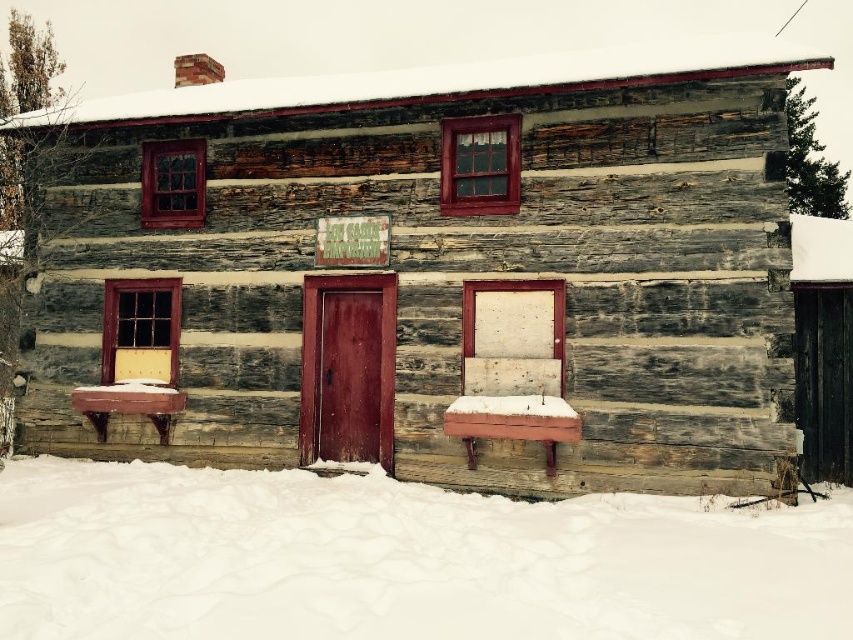
Who is higher up, wooden cabin at center or wooden bench at center?

wooden cabin at center

Which is in front, point (604, 160) or point (503, 328)?

Point (604, 160)

This screenshot has width=853, height=640. I want to click on wooden cabin at center, so click(428, 273).

This screenshot has width=853, height=640. In order to click on wooden cabin at center in this screenshot , I will do pyautogui.click(x=428, y=273).

Which is behind, point (695, 134) or point (373, 474)?

The point (373, 474) is behind.

At what (x,y) coordinates should I click in order to perform the action: click on wooden cabin at center. Please return your answer as a coordinate pair (x, y). Looking at the image, I should click on (428, 273).

Does white fluffy snow at lower center appear on the right side of wooden bench at center?

Indeed, white fluffy snow at lower center is positioned on the right side of wooden bench at center.

Who is higher up, white fluffy snow at lower center or wooden bench at center?

wooden bench at center is higher up.

Image resolution: width=853 pixels, height=640 pixels. What do you see at coordinates (401, 560) in the screenshot? I see `white fluffy snow at lower center` at bounding box center [401, 560].

Where is `white fluffy snow at lower center`? The image size is (853, 640). white fluffy snow at lower center is located at coordinates (401, 560).